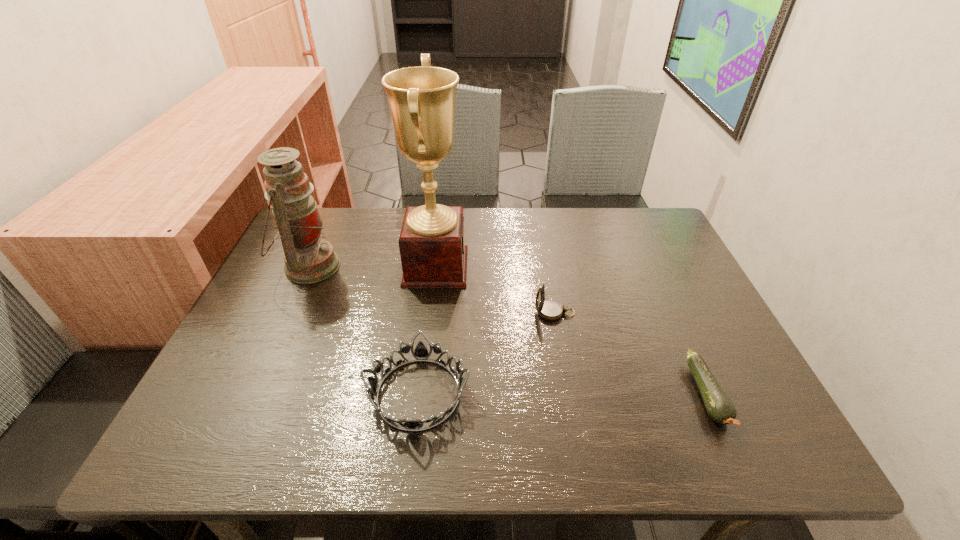
Locate an element on the screen. The height and width of the screenshot is (540, 960). object at the far left corner is located at coordinates (308, 259).

The height and width of the screenshot is (540, 960). Find the location of `object located at the near right corner`. object located at the near right corner is located at coordinates (719, 406).

Identify the location of free space at the far edge. (396, 209).

You are a GUI agent. You are given a task and a screenshot of the screen. Output one action in this format:
    pyautogui.click(x=<x>, y=<y>)
    Task: Click on the vacant space at the near edge of the desktop
    The width and height of the screenshot is (960, 540).
    Given the screenshot: What is the action you would take?
    pyautogui.click(x=345, y=419)

Where is `vacant space at the left edge of the desktop`? vacant space at the left edge of the desktop is located at coordinates (253, 310).

Find the location of a particular element. Image resolution: width=960 pixels, height=540 pixels. free spot at the right edge of the desktop is located at coordinates (709, 341).

Identify the location of free space at the far left corner of the desktop. (322, 210).

The width and height of the screenshot is (960, 540). I want to click on free space at the near right corner of the desktop, so click(760, 424).

The height and width of the screenshot is (540, 960). Identify the location of free spot between the leftmost object and the tallest object. (372, 267).

Where is `vacant area that lies between the trophy cup and the zucchini`? This screenshot has height=540, width=960. vacant area that lies between the trophy cup and the zucchini is located at coordinates tap(571, 331).